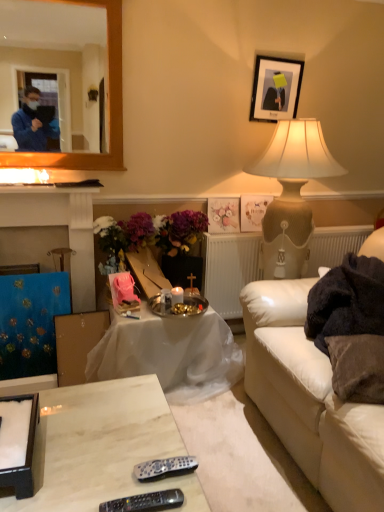
At what (x,y) coordinates should I click in order to perform the action: click on vacant space behind black plastic remote at lower center, the 1th remote viewed from the front. Please return your answer as a coordinate pair (x, y). This screenshot has width=384, height=512. Looking at the image, I should click on (137, 466).